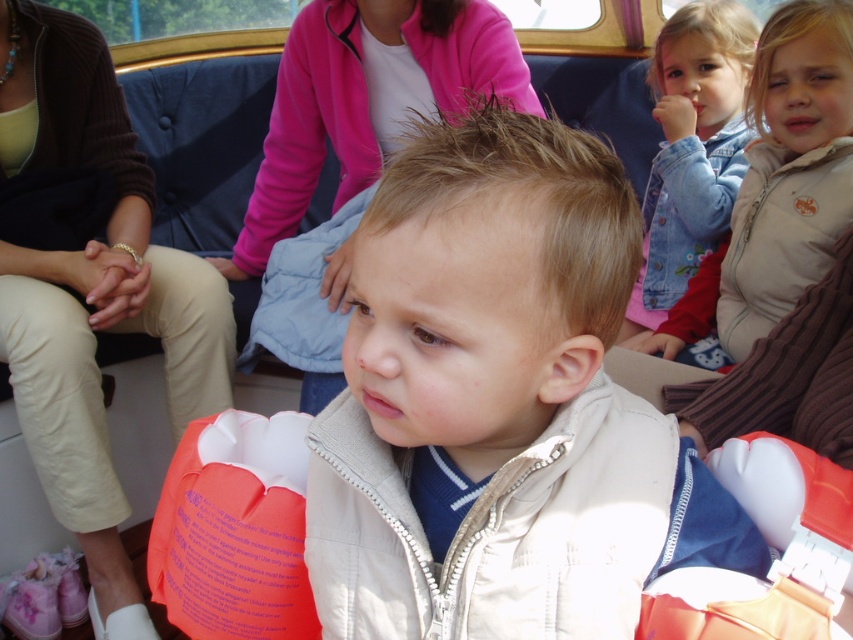
Does point (514, 540) come closer to viewer compared to point (759, 188)?

Yes, it is.

Between white matte vest at center and beige fleece jacket at upper right, which one appears on the right side from the viewer's perspective?

beige fleece jacket at upper right

This screenshot has width=853, height=640. What are the coordinates of `white matte vest at center` in the screenshot? It's located at (500, 406).

Is white matte vest at center bigger than denim jacket at upper right?

Actually, white matte vest at center might be smaller than denim jacket at upper right.

Which of these two, white matte vest at center or denim jacket at upper right, stands shorter?

With less height is white matte vest at center.

Is point (447, 552) farther from camera compared to point (708, 112)?

No, it is not.

Where is `white matte vest at center`? The width and height of the screenshot is (853, 640). white matte vest at center is located at coordinates (500, 406).

Who is positioned more to the right, orange life vest at lower left or denim jacket at upper right?

Positioned to the right is denim jacket at upper right.

This screenshot has width=853, height=640. What do you see at coordinates (91, 292) in the screenshot? I see `orange life vest at lower left` at bounding box center [91, 292].

Is point (212, 268) closer to viewer compared to point (694, 65)?

Yes, point (212, 268) is closer to viewer.

The height and width of the screenshot is (640, 853). What are the coordinates of `orange life vest at lower left` in the screenshot? It's located at (91, 292).